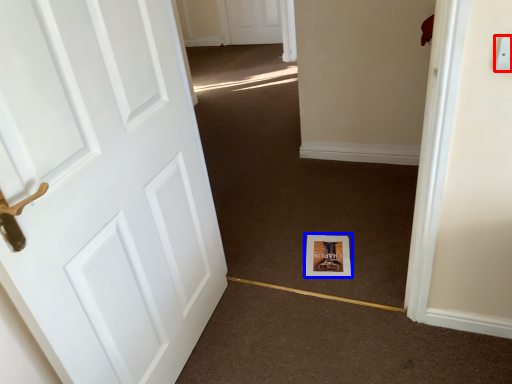
Question: Which object is further to the camera taking this photo, electric outlet (highlighted by a red box) or print (highlighted by a blue box)?

Choices:
 (A) electric outlet
 (B) print

Answer: (B)